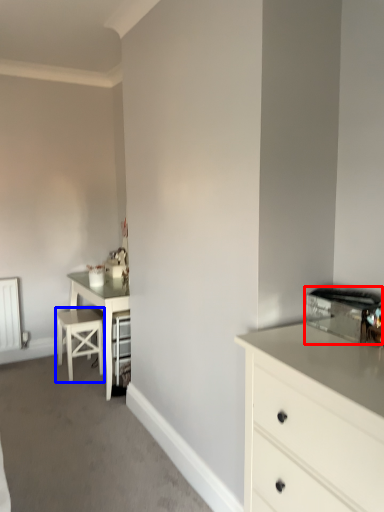
Question: Which point is further to the camera, appliance (highlighted by a red box) or bar stool (highlighted by a blue box)?

Choices:
 (A) appliance
 (B) bar stool

Answer: (B)